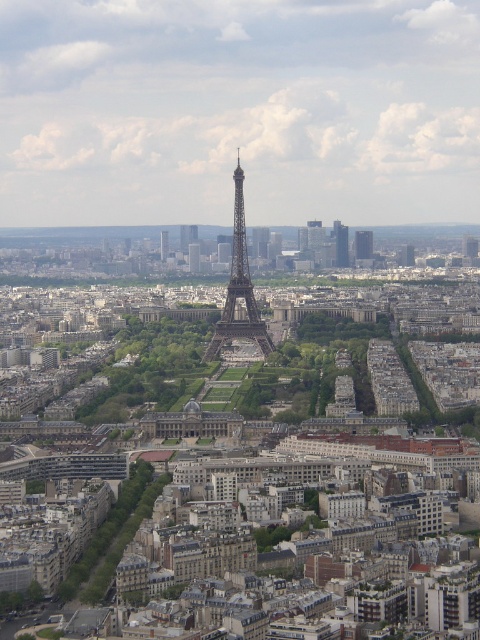
Question: Considering the relative positions of glassy skyscraper at center right and silver metallic tower at center in the image provided, where is glassy skyscraper at center right located with respect to silver metallic tower at center?

Choices:
 (A) right
 (B) left

Answer: (A)

Question: Which object is positioned farthest from the glassy skyscraper at center right?

Choices:
 (A) glassy reflective skyscraper at center
 (B) silver metallic tower at center
 (C) shiny metallic eiffel tower at center

Answer: (C)

Question: Does shiny metallic eiffel tower at center have a lesser width compared to smooth gray tower at center?

Choices:
 (A) no
 (B) yes

Answer: (A)

Question: Is glassy skyscraper at center right closer to camera compared to smooth gray tower at center?

Choices:
 (A) no
 (B) yes

Answer: (B)

Question: Which object appears farthest from the camera in this image?

Choices:
 (A) silver metallic tower at center
 (B) glassy skyscraper at center right
 (C) glassy reflective skyscraper at center

Answer: (C)

Question: Which object is farther from the camera taking this photo?

Choices:
 (A) glassy skyscraper at center right
 (B) smooth gray tower at center
 (C) glassy reflective skyscraper at center

Answer: (B)